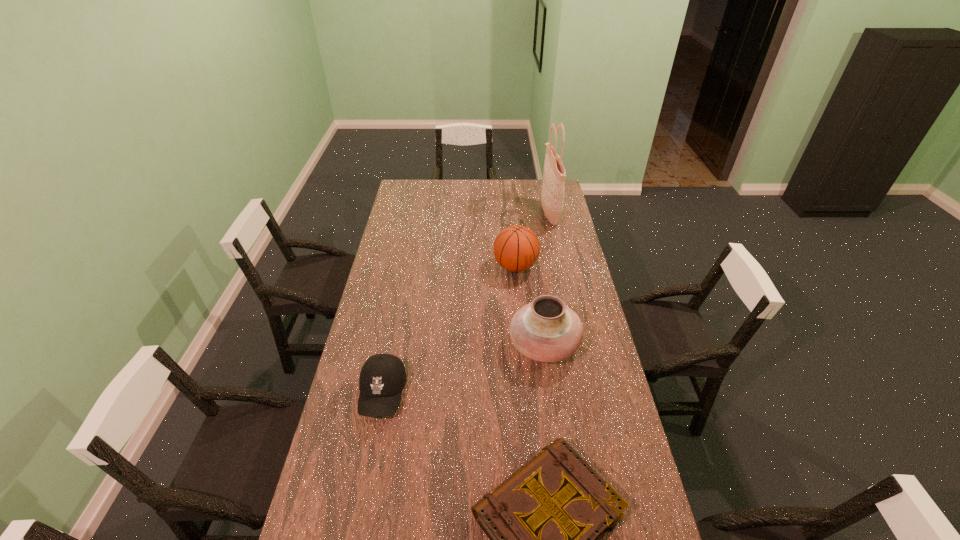
What are the coordinates of `object that is positioned at the far edge` in the screenshot? It's located at (552, 197).

Find the location of `object present at the left edge`. object present at the left edge is located at coordinates pyautogui.click(x=382, y=378).

Identify the location of shopping bag located at the right edge. (552, 197).

Locate an element on the screen. pottery present at the right edge is located at coordinates (546, 330).

The height and width of the screenshot is (540, 960). I want to click on object situated at the far right corner, so click(552, 197).

I want to click on free space at the far edge of the desktop, so click(x=450, y=200).

The width and height of the screenshot is (960, 540). In the image, there is a desktop. In order to click on vacant space at the left edge in this screenshot , I will do `click(398, 258)`.

The height and width of the screenshot is (540, 960). In order to click on vacant space at the right edge of the desktop in this screenshot , I will do `click(587, 321)`.

This screenshot has height=540, width=960. I want to click on free space at the far left corner of the desktop, so click(426, 187).

The width and height of the screenshot is (960, 540). What are the coordinates of `unoccupied position between the pottery and the baseball cap` in the screenshot? It's located at (464, 369).